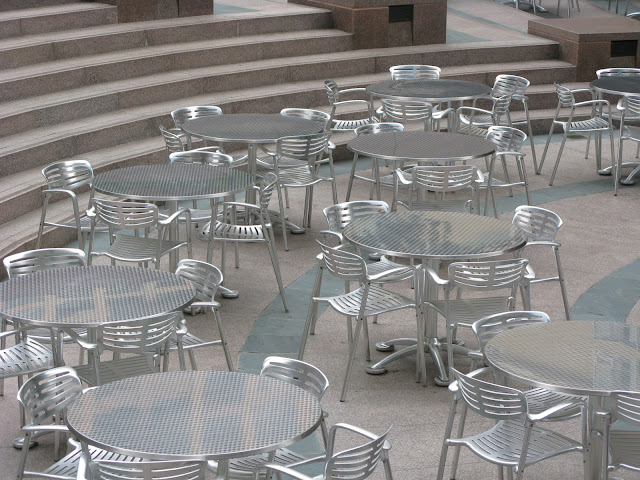
The width and height of the screenshot is (640, 480). Find the location of `columns`. columns is located at coordinates (164, 9), (386, 12), (586, 46).